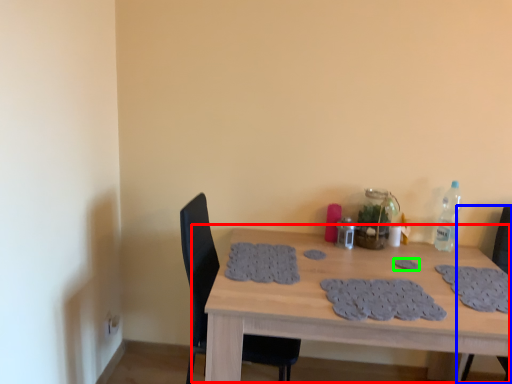
Question: Which object is positioned farthest from table (highlighted by a red box)? Select from chair (highlighted by a blue box) and footprint (highlighted by a green box).

Choices:
 (A) chair
 (B) footprint

Answer: (A)